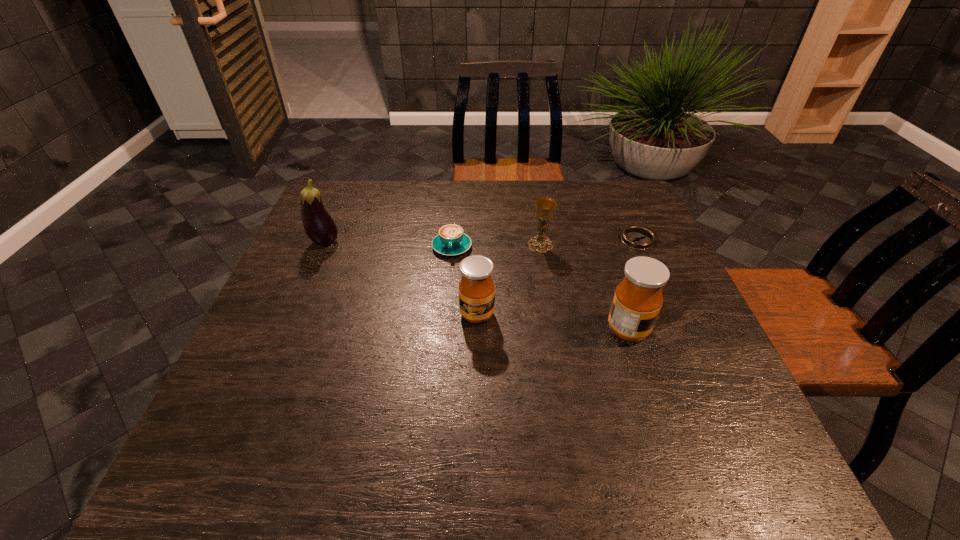
Identify the location of free location at the right edge of the desktop. This screenshot has height=540, width=960. (664, 253).

Where is `free space at the far left corner of the desktop`? This screenshot has height=540, width=960. free space at the far left corner of the desktop is located at coordinates (368, 191).

In the image, there is a desktop. Identify the location of vacant space at the far right corner. The width and height of the screenshot is (960, 540). coord(597,212).

The width and height of the screenshot is (960, 540). Identify the location of unoccupied area between the fifth tallest object and the chalice. (496, 246).

The height and width of the screenshot is (540, 960). Find the location of `free point between the second object from right to left and the left honey`. free point between the second object from right to left and the left honey is located at coordinates (552, 322).

Where is `empty location between the rightmost object and the chalice`? This screenshot has width=960, height=540. empty location between the rightmost object and the chalice is located at coordinates (588, 242).

I want to click on empty space between the second object from right to left and the fourth object from left to right, so click(584, 287).

Find the location of a particular element. This screenshot has width=960, height=540. free space between the taller honey and the shorter honey is located at coordinates (552, 322).

This screenshot has height=540, width=960. Find the location of `free space between the taller honey and the cappuccino`. free space between the taller honey and the cappuccino is located at coordinates (540, 288).

In order to click on empty space that is in between the shortest object and the eggplant in this screenshot , I will do `click(481, 241)`.